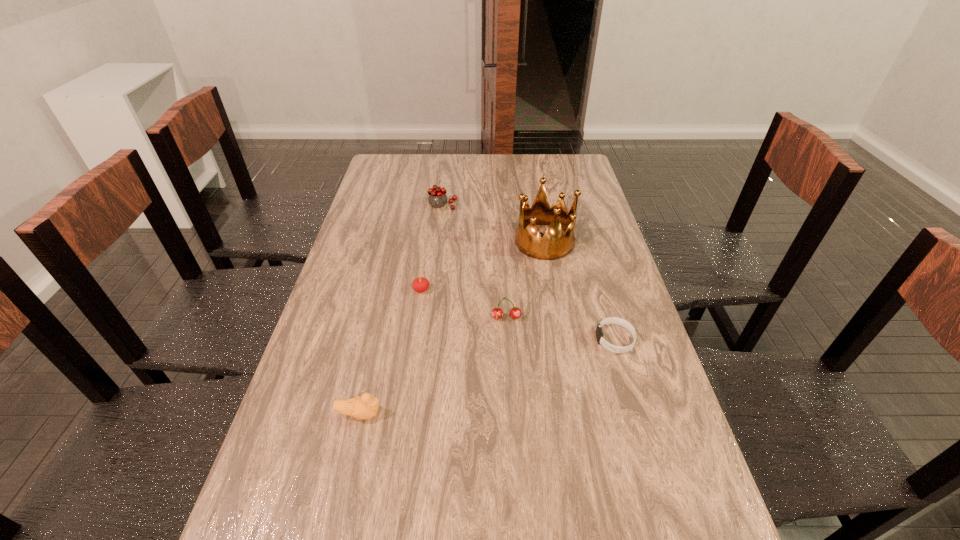
The image size is (960, 540). I want to click on crown present at the right edge, so click(x=554, y=245).

The image size is (960, 540). In order to click on wristband that is at the right edge in this screenshot , I will do `click(610, 320)`.

The height and width of the screenshot is (540, 960). What are the coordinates of `vacant space at the far edge` in the screenshot? It's located at (482, 153).

The height and width of the screenshot is (540, 960). I want to click on free region at the left edge of the desktop, so click(x=404, y=185).

Where is `blank space at the right edge`? blank space at the right edge is located at coordinates (612, 358).

Locate an element on the screen. This screenshot has height=540, width=960. free region at the far left corner of the desktop is located at coordinates (406, 155).

You are a GUI agent. You are given a task and a screenshot of the screen. Output one action in this format:
    pyautogui.click(x=<x>, y=<y>)
    Task: Click on the free space at the far right corner of the desktop
    The image size is (960, 540).
    Given the screenshot: What is the action you would take?
    pyautogui.click(x=585, y=179)

Identify the location of blank region between the crown and the second farthest cherry. (483, 266).

Find the location of a particular element. free space between the tallest cherry and the nearest cherry is located at coordinates (474, 262).

Image resolution: width=960 pixels, height=540 pixels. What are the coordinates of `free space between the nearest object and the fifth nearest object` in the screenshot? It's located at (452, 328).